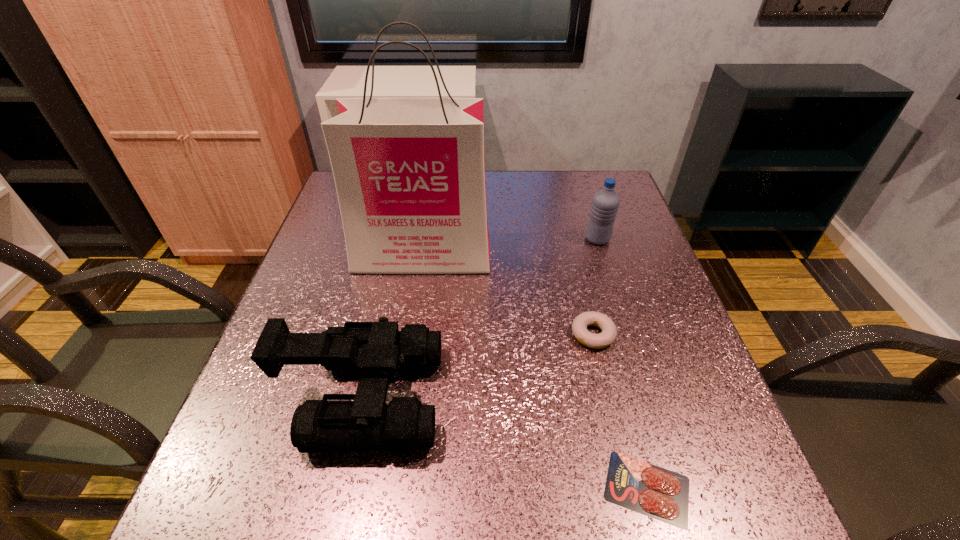
This screenshot has width=960, height=540. Identify the location of shopping bag. (409, 173).

Identify the location of water bottle. This screenshot has width=960, height=540. (605, 203).

This screenshot has height=540, width=960. What are the coordinates of `binoculars` in the screenshot? It's located at (375, 350).

Where is `the second shortest object`? The height and width of the screenshot is (540, 960). the second shortest object is located at coordinates (608, 335).

Where is `salami`? Image resolution: width=960 pixels, height=540 pixels. salami is located at coordinates (639, 486).

Locate an element on the screen. vacant position located on the front-facing side of the shopping bag is located at coordinates (416, 300).

Image resolution: width=960 pixels, height=540 pixels. What are the coordinates of `vacant space located on the left of the water bottle` in the screenshot? It's located at (479, 239).

Find the location of a particular element. This screenshot has height=540, width=960. free space located on the front lenses of the binoculars is located at coordinates (527, 397).

Image resolution: width=960 pixels, height=540 pixels. In order to click on free space located on the back of the second shortest object in this screenshot , I will do `click(576, 262)`.

Identify the location of free space located on the right of the shortest object. (757, 488).